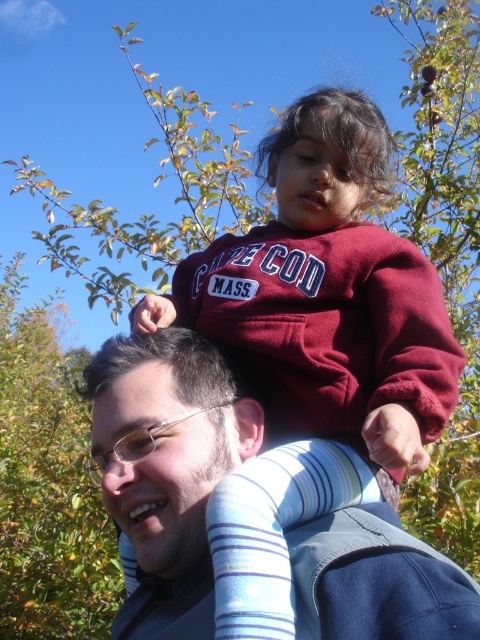
You are a photographer trying to capture a candid shot of both the maroon fleece at upper center and the matte blue shirt at upper center. However, you notice that one of them is partially blocking the other. Which object is obstructing the view of the other?

The maroon fleece at upper center is in front of the matte blue shirt at upper center, so it is obstructing the view of the matte blue shirt at upper center.

You are a photographer trying to capture a candid shot of the two subjects in the scene. The maroon fleece at upper center and the matte blue shirt at upper center are both in your frame. Which object is positioned higher in the image?

The maroon fleece at upper center is positioned higher in the image than the matte blue shirt at upper center.

You are a photographer trying to capture the maroon fleece at upper center and the matte blue shirt at upper center in a single shot. Which object should you focus on first to ensure both are in frame?

The maroon fleece at upper center is positioned over the matte blue shirt at upper center, so you should focus on the matte blue shirt at upper center first to ensure both are visible in the frame.